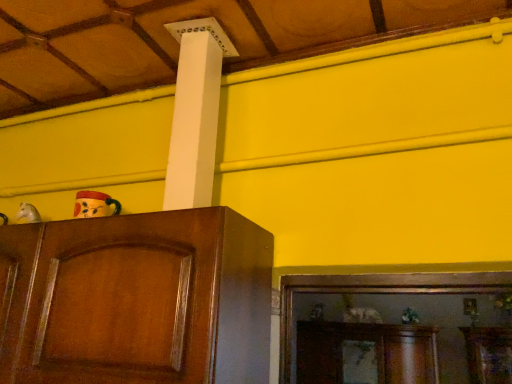
Question: Can you confirm if green matte plant at lower right, the 3th toy in the left-to-right sequence, is shorter than white matte horse head at left, the first toy viewed from the left?

Choices:
 (A) yes
 (B) no

Answer: (B)

Question: Is green matte plant at lower right, arranged as the third toy when viewed from the front, smaller than white matte horse head at left, the 2th toy positioned from the top?

Choices:
 (A) no
 (B) yes

Answer: (A)

Question: Is green matte plant at lower right, arranged as the third toy when viewed from the front, to the right of white matte horse head at left, positioned as the 2th toy in bottom-to-top order, from the viewer's perspective?

Choices:
 (A) no
 (B) yes

Answer: (B)

Question: Does green matte plant at lower right, the 1th toy positioned from the back, have a lesser width compared to white matte horse head at left, positioned as the 2th toy in bottom-to-top order?

Choices:
 (A) no
 (B) yes

Answer: (A)

Question: Is the position of green matte plant at lower right, the 1th toy positioned from the back, more distant than that of white matte horse head at left, the second toy when ordered from front to back?

Choices:
 (A) no
 (B) yes

Answer: (B)

Question: From the image's perspective, is green matte plant at lower right, the first toy in the bottom-to-top sequence, on top of white matte horse head at left, the second toy when ordered from front to back?

Choices:
 (A) yes
 (B) no

Answer: (B)

Question: Does white matte horse head at left, the 2th toy positioned from the top, have a smaller size compared to shiny brown cabinet at left?

Choices:
 (A) no
 (B) yes

Answer: (B)

Question: From the image's perspective, is white matte horse head at left, marked as the 3th toy in a right-to-left arrangement, located above shiny brown cabinet at left?

Choices:
 (A) yes
 (B) no

Answer: (A)

Question: Is white matte horse head at left, positioned as the second toy in back-to-front order, thinner than shiny brown cabinet at left?

Choices:
 (A) no
 (B) yes

Answer: (B)

Question: Can you confirm if white matte horse head at left, positioned as the second toy in back-to-front order, is wider than shiny brown cabinet at left?

Choices:
 (A) no
 (B) yes

Answer: (A)

Question: Is there a large distance between white matte horse head at left, the second toy when ordered from front to back, and shiny brown cabinet at left?

Choices:
 (A) yes
 (B) no

Answer: (B)

Question: Is white matte horse head at left, the first toy viewed from the left, positioned with its back to shiny brown cabinet at left?

Choices:
 (A) no
 (B) yes

Answer: (A)

Question: Considering the relative sizes of white matte horse head at left, the first toy viewed from the left, and matte wooden mask at left, arranged as the first toy when viewed from the front, in the image provided, is white matte horse head at left, the first toy viewed from the left, shorter than matte wooden mask at left, arranged as the first toy when viewed from the front,?

Choices:
 (A) no
 (B) yes

Answer: (B)